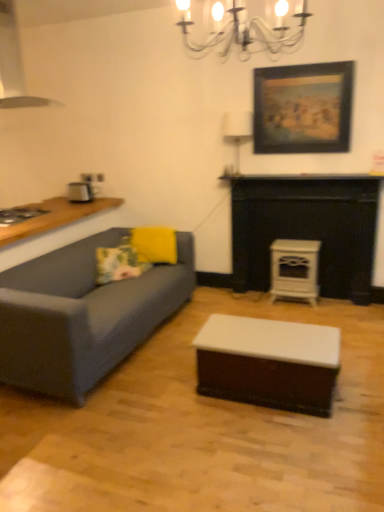
Consider the image. Measure the distance between point (x=291, y=179) and camera.

A distance of 3.68 meters exists between point (x=291, y=179) and camera.

The image size is (384, 512). What do you see at coordinates (300, 178) in the screenshot?
I see `white glossy counter top at upper center` at bounding box center [300, 178].

This screenshot has width=384, height=512. What do you see at coordinates (119, 262) in the screenshot? I see `floral fabric pillow at left, the 1th pillow in the left-to-right sequence` at bounding box center [119, 262].

This screenshot has height=512, width=384. What do you see at coordinates (155, 245) in the screenshot?
I see `yellow matte pillow at center, the second pillow viewed from the left` at bounding box center [155, 245].

Find the location of a particular element. white glossy counter top at upper center is located at coordinates (300, 178).

In terms of width, does metallic silver exhaust hood at upper left look wider or thinner when compared to floral fabric pillow at left, the 1th pillow in the left-to-right sequence?

Considering their sizes, metallic silver exhaust hood at upper left looks broader than floral fabric pillow at left, the 1th pillow in the left-to-right sequence.

Is metallic silver exhaust hood at upper left not close to floral fabric pillow at left, which is counted as the 2th pillow, starting from the right?

metallic silver exhaust hood at upper left is positioned a significant distance from floral fabric pillow at left, which is counted as the 2th pillow, starting from the right.

From the image's perspective, is metallic silver exhaust hood at upper left positioned above or below floral fabric pillow at left, which is counted as the 2th pillow, starting from the right?

metallic silver exhaust hood at upper left is situated higher than floral fabric pillow at left, which is counted as the 2th pillow, starting from the right, in the image.

Who is shorter, metallic silver exhaust hood at upper left or floral fabric pillow at left, the 1th pillow in the left-to-right sequence?

floral fabric pillow at left, the 1th pillow in the left-to-right sequence.

Is point (14, 96) closer or farther from the camera than point (217, 3)?

Point (14, 96) is farther from the camera than point (217, 3).

Is the depth of metallic silver exhaust hood at upper left less than that of white glass chandelier at upper center?

No, metallic silver exhaust hood at upper left is further to the viewer.

Is white glass chandelier at upper center at the back of metallic silver exhaust hood at upper left?

That's not correct — metallic silver exhaust hood at upper left is not looking away from white glass chandelier at upper center.

Is wooden framed painting at upper right not close to white glossy counter top at upper center?

They are positioned close to each other.

Locate an element on the screen. Image resolution: width=384 pixels, height=512 pixels. picture frame above the white glossy counter top at upper center (from a real-world perspective) is located at coordinates click(303, 108).

Between wooden framed painting at upper right and white glossy counter top at upper center, which one has larger width?

With larger width is white glossy counter top at upper center.

Between point (260, 110) and point (231, 180), which one is positioned behind?

The point (231, 180) is farther from the camera.

Between point (337, 227) and point (166, 231), which one is positioned in front?

The point (337, 227) is more forward.

In order to click on pillow that is behind the white glossy fireplace at center in this screenshot , I will do click(x=155, y=245).

Is white glossy fireplace at center positioned before yellow matte pillow at center, acting as the 1th pillow starting from the right?

Yes, white glossy fireplace at center is in front of yellow matte pillow at center, acting as the 1th pillow starting from the right.

Could you measure the distance between white glossy fireplace at center and yellow matte pillow at center, the second pillow viewed from the left?

white glossy fireplace at center is 1.08 meters from yellow matte pillow at center, the second pillow viewed from the left.

Considering the relative positions of white glossy fireplace at center and metallic silver exhaust hood at upper left in the image provided, is white glossy fireplace at center to the left of metallic silver exhaust hood at upper left from the viewer's perspective?

No, white glossy fireplace at center is not to the left of metallic silver exhaust hood at upper left.

From a real-world perspective, is white glossy fireplace at center over metallic silver exhaust hood at upper left?

Incorrect, from a real-world perspective, white glossy fireplace at center is lower than metallic silver exhaust hood at upper left.

How distant is white glossy fireplace at center from metallic silver exhaust hood at upper left?

2.68 meters.

Is white glossy fireplace at center positioned beyond the bounds of metallic silver exhaust hood at upper left?

Absolutely, white glossy fireplace at center is external to metallic silver exhaust hood at upper left.

From a real-world perspective, is white fabric lampshade at upper center physically located above or below white glossy fireplace at center?

From a real-world perspective, white fabric lampshade at upper center is physically above white glossy fireplace at center.

Is white glossy fireplace at center inside white fabric lampshade at upper center?

No, white glossy fireplace at center is not surrounded by white fabric lampshade at upper center.

How many degrees apart are the facing directions of white fabric lampshade at upper center and white glossy fireplace at center?

The angular difference between white fabric lampshade at upper center and white glossy fireplace at center is 0.402 degrees.

Considering the relative positions of white fabric lampshade at upper center and white glossy fireplace at center in the image provided, is white fabric lampshade at upper center to the left or to the right of white glossy fireplace at center?

white fabric lampshade at upper center is positioned on white glossy fireplace at center's left side.

Can you tell me how much white glossy fireplace at center and floral fabric pillow at left, the 1th pillow in the left-to-right sequence, differ in facing direction?

They differ by 35.4 degrees in their facing directions.

Considering the sizes of white glossy fireplace at center and floral fabric pillow at left, which is counted as the 2th pillow, starting from the right, in the image, is white glossy fireplace at center bigger or smaller than floral fabric pillow at left, which is counted as the 2th pillow, starting from the right,?

Considering their sizes, white glossy fireplace at center takes up more space than floral fabric pillow at left, which is counted as the 2th pillow, starting from the right.

From the image's perspective, which object appears higher, white glossy fireplace at center or floral fabric pillow at left, the 1th pillow in the left-to-right sequence?

white glossy fireplace at center is shown above in the image.

From a real-world perspective, between white glossy fireplace at center and floral fabric pillow at left, the 1th pillow in the left-to-right sequence, who is vertically lower?

floral fabric pillow at left, the 1th pillow in the left-to-right sequence, is physically lower.

The image size is (384, 512). I want to click on the 1st pillow counting from the right side of the metallic silver exhaust hood at upper left, so click(x=119, y=262).

In the image, there is a white glass chandelier at upper center. Identify the location of exhaust hood above it (from the image's perspective). (14, 64).

Considering their positions, is wooden framed painting at upper right positioned further to metallic silver toaster at left, positioned as the second appliance in bottom-to-top order, than white glass chandelier at upper center?

white glass chandelier at upper center is positioned further to the anchor metallic silver toaster at left, positioned as the second appliance in bottom-to-top order.

Based on their spatial positions, is wooden framed painting at upper right or metallic silver exhaust hood at upper left closer to white glossy counter top at upper center?

wooden framed painting at upper right lies closer to white glossy counter top at upper center than the other object.

Looking at the image, which one is located further to white fabric lampshade at upper center, floral fabric pillow at left, the 1th pillow in the left-to-right sequence, or white glossy coffee table at center?

white glossy coffee table at center is positioned further to the anchor white fabric lampshade at upper center.

Looking at the image, which one is located further to white glossy stove at center-right, which is counted as the 2th appliance, starting from the top, white glossy fireplace at center or metallic silver toaster at left, positioned as the 1th appliance in top-to-bottom order?

metallic silver toaster at left, positioned as the 1th appliance in top-to-bottom order, lies further to white glossy stove at center-right, which is counted as the 2th appliance, starting from the top, than the other object.

Which object lies further to the anchor point yellow matte pillow at center, the second pillow viewed from the left, floral fabric pillow at left, the 1th pillow in the left-to-right sequence, or white fabric lampshade at upper center?

white fabric lampshade at upper center lies further to yellow matte pillow at center, the second pillow viewed from the left, than the other object.

Estimate the real-world distances between objects in this image. Which object is further from floral fabric pillow at left, the 1th pillow in the left-to-right sequence, white fabric lampshade at upper center or metallic silver toaster at left, positioned as the 1th appliance in top-to-bottom order?

white fabric lampshade at upper center is further to floral fabric pillow at left, the 1th pillow in the left-to-right sequence.

Estimate the real-world distances between objects in this image. Which object is further from white glossy fireplace at center, white glossy counter top at upper center or wooden framed painting at upper right?

Based on the image, wooden framed painting at upper right appears to be further to white glossy fireplace at center.

Estimate the real-world distances between objects in this image. Which object is further from white glossy coffee table at center, metallic silver exhaust hood at upper left or yellow matte pillow at center, acting as the 1th pillow starting from the right?

metallic silver exhaust hood at upper left.

Locate an element on the screen. This screenshot has height=512, width=384. pillow between white fabric lampshade at upper center and floral fabric pillow at left, the 1th pillow in the left-to-right sequence, from top to bottom is located at coordinates [x=155, y=245].

Where is `fireplace between white glass chandelier at upper center and yellow matte pillow at center, the second pillow viewed from the left, from front to back`? The width and height of the screenshot is (384, 512). fireplace between white glass chandelier at upper center and yellow matte pillow at center, the second pillow viewed from the left, from front to back is located at coordinates (307, 230).

Identify the location of counter top between white fabric lampshade at upper center and white glossy fireplace at center from top to bottom. The height and width of the screenshot is (512, 384). (300, 178).

Locate an element on the screen. fireplace between white fabric lampshade at upper center and white glossy coffee table at center vertically is located at coordinates (307, 230).